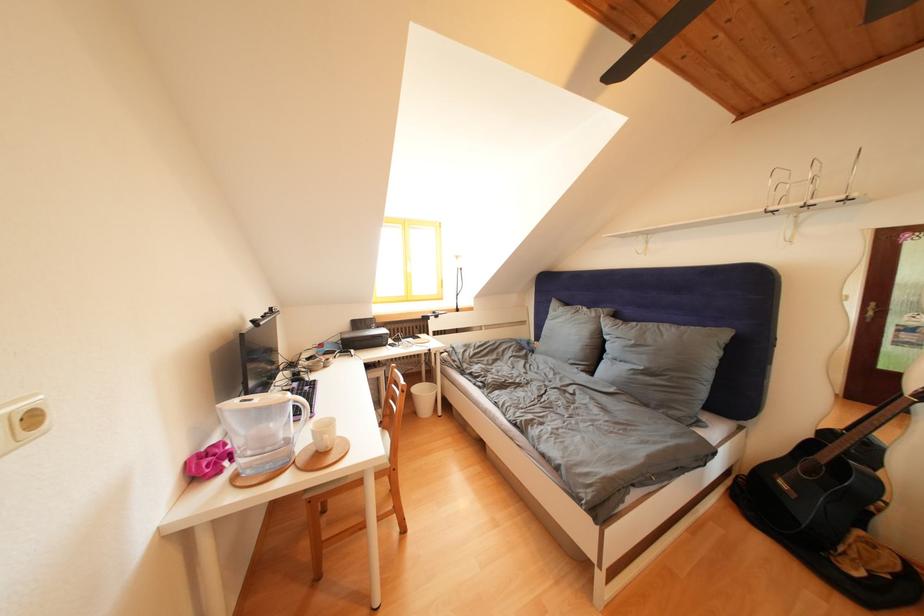
Where would you lift the white mug? Please return your answer as a coordinate pair (x, y).

(322, 434)